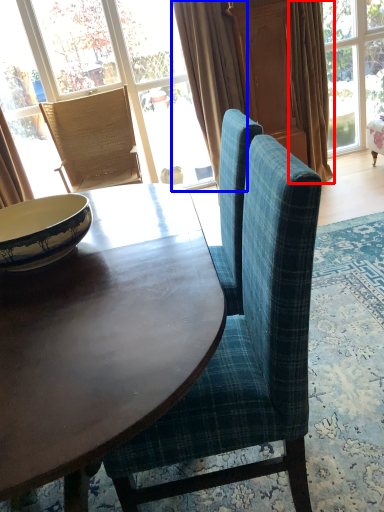
Question: Which point is further to the camera, curtain (highlighted by a red box) or curtain (highlighted by a blue box)?

Choices:
 (A) curtain
 (B) curtain

Answer: (A)